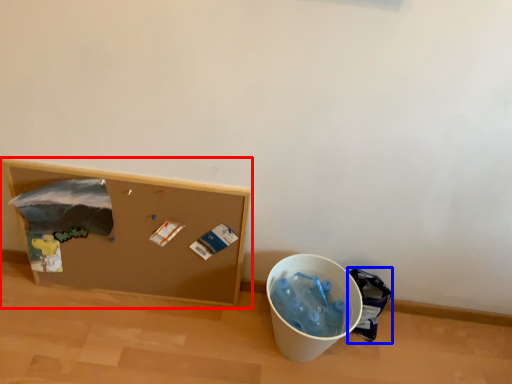
Question: Which point is closer to the camera, furniture (highlighted by a red box) or garbage (highlighted by a blue box)?

Choices:
 (A) furniture
 (B) garbage

Answer: (A)